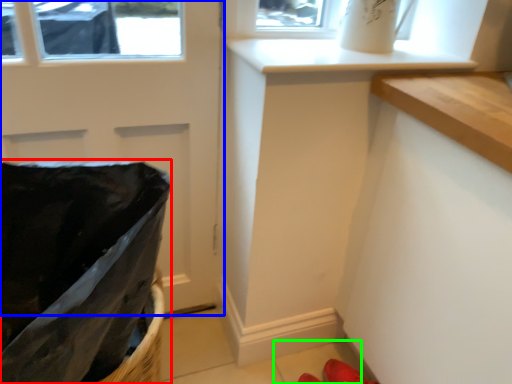
Question: Which object is positioned farthest from laundry basket (highlighted by a red box)? Select from door (highlighted by a blue box) and tile (highlighted by a green box).

Choices:
 (A) door
 (B) tile

Answer: (B)